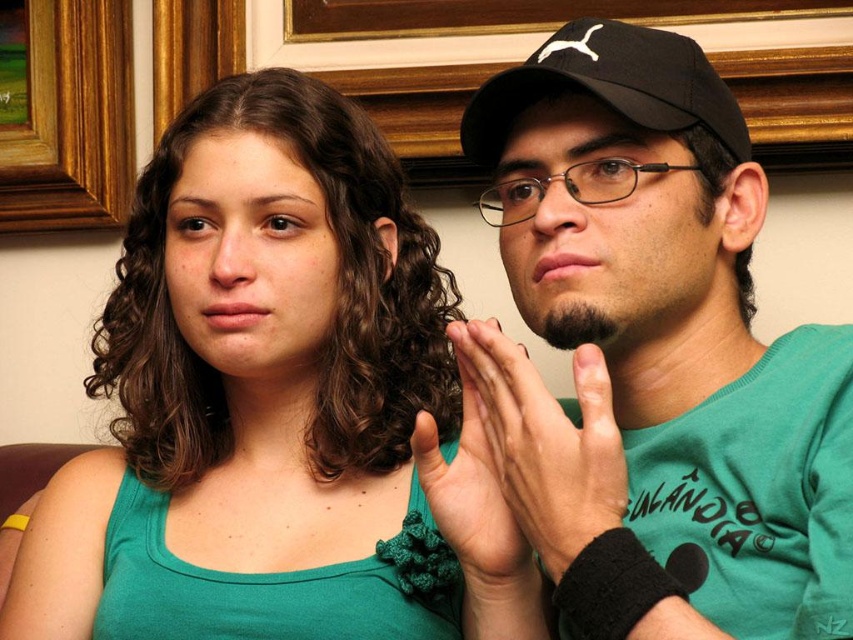
Between point (579, 214) and point (625, 93), which one is positioned behind?

The point (625, 93) is behind.

Can you confirm if black matte cap at upper center is shorter than black fabric baseball cap at upper center?

No.

Describe the element at coordinates (654, 355) in the screenshot. The width and height of the screenshot is (853, 640). I see `black matte cap at upper center` at that location.

Find the location of a particular element. The height and width of the screenshot is (640, 853). black matte cap at upper center is located at coordinates (654, 355).

Can you confirm if smooth skin hands at center is smaller than matte green fabric at center?

Actually, smooth skin hands at center might be larger than matte green fabric at center.

Does smooth skin hands at center have a lesser width compared to matte green fabric at center?

In fact, smooth skin hands at center might be wider than matte green fabric at center.

In the scene shown: Who is more forward, (601, 532) or (469, 413)?

Point (601, 532)

Image resolution: width=853 pixels, height=640 pixels. Identify the location of smooth skin hands at center. (546, 444).

Describe the element at coordinates (276, 406) in the screenshot. This screenshot has height=640, width=853. I see `green fabric tank top at center` at that location.

Which is more to the left, green fabric tank top at center or brown wooden picture frame at upper left?

Positioned to the left is brown wooden picture frame at upper left.

Between point (277, 202) and point (57, 67), which one is positioned behind?

The point (57, 67) is behind.

Where is `green fabric tank top at center`? The height and width of the screenshot is (640, 853). green fabric tank top at center is located at coordinates (276, 406).